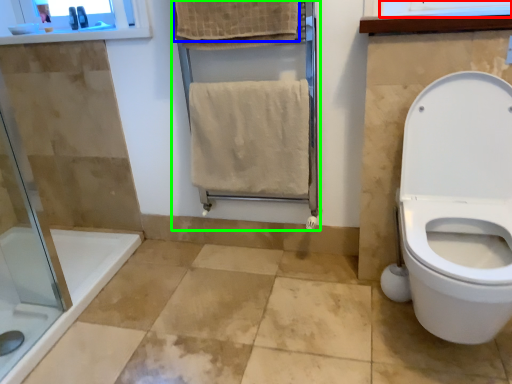
Question: Based on their relative distances, which object is farther from window frame (highlighted by a red box)? Choose from bath towel (highlighted by a blue box) and screen door (highlighted by a green box).

Choices:
 (A) bath towel
 (B) screen door

Answer: (B)